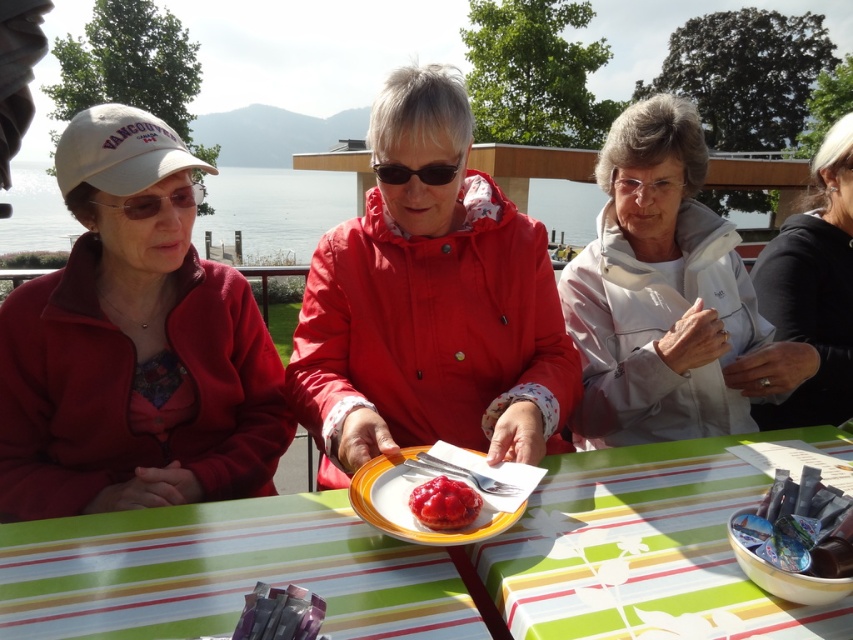
Is glossy red jam tart at center smaller than black plastic goggles at center?

Yes, glossy red jam tart at center is smaller than black plastic goggles at center.

Looking at this image, can you confirm if glossy red jam tart at center is positioned above black plastic goggles at center?

No, glossy red jam tart at center is not above black plastic goggles at center.

Image resolution: width=853 pixels, height=640 pixels. What do you see at coordinates (444, 502) in the screenshot?
I see `glossy red jam tart at center` at bounding box center [444, 502].

At what (x,y) coordinates should I click in order to perform the action: click on glossy red jam tart at center. Please return your answer as a coordinate pair (x, y). This screenshot has height=640, width=853. Looking at the image, I should click on (444, 502).

Is matte red jacket at center above white matte jacket at upper right?

No.

Is matte red jacket at center further to camera compared to white matte jacket at upper right?

That is False.

Locate an element on the screen. matte red jacket at center is located at coordinates (430, 305).

Is striped plastic table at center above clear plastic goggles at left?

Incorrect, striped plastic table at center is not positioned above clear plastic goggles at left.

Which is in front, point (166, 520) or point (170, 202)?

Positioned in front is point (166, 520).

Image resolution: width=853 pixels, height=640 pixels. Find the location of `striped plastic table at center`. striped plastic table at center is located at coordinates (223, 572).